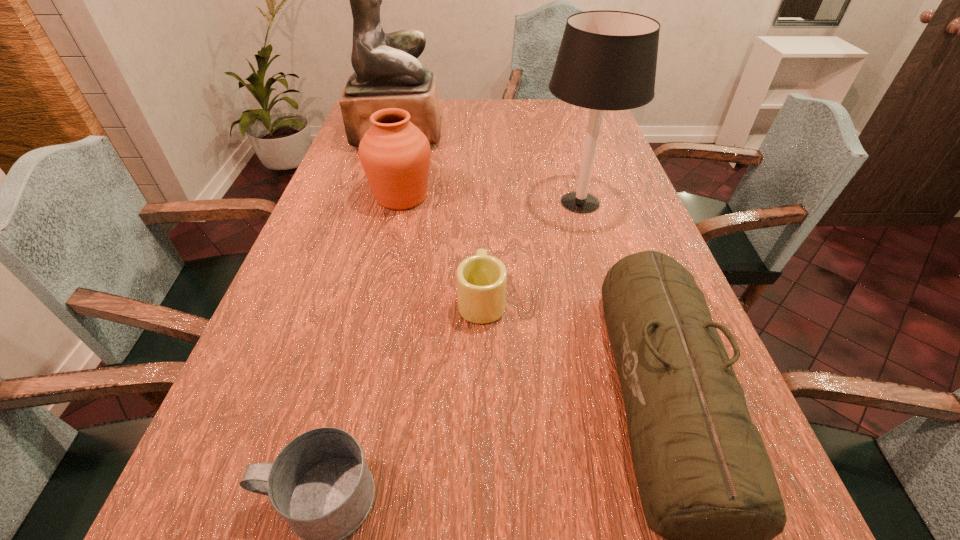
The height and width of the screenshot is (540, 960). In order to click on vacant space located 0.250m with the handle on the side of the right mug in this screenshot , I will do `click(481, 211)`.

Find the location of `vacant space located 0.220m with the handle on the side of the right mug`. vacant space located 0.220m with the handle on the side of the right mug is located at coordinates (481, 218).

Locate an element on the screen. object at the far edge is located at coordinates coord(387,74).

You are a GUI agent. You are given a task and a screenshot of the screen. Output one action in this format:
    pyautogui.click(x=<x>, y=<y>)
    Task: Click on the sculpture present at the left edge
    The image size is (960, 540).
    Given the screenshot: What is the action you would take?
    pyautogui.click(x=387, y=74)

This screenshot has width=960, height=540. What are the coordinates of `urn located at the left edge` in the screenshot? It's located at (395, 155).

The height and width of the screenshot is (540, 960). I want to click on object at the right edge, so click(x=607, y=60).

Locate an element on the screen. object located at the far left corner is located at coordinates (387, 74).

I want to click on vacant region at the far edge, so click(x=484, y=114).

The image size is (960, 540). Identify the location of free space at the left edge of the desktop. (343, 230).

In the image, there is a desktop. Find the location of `vacant space at the right edge`. vacant space at the right edge is located at coordinates (616, 240).